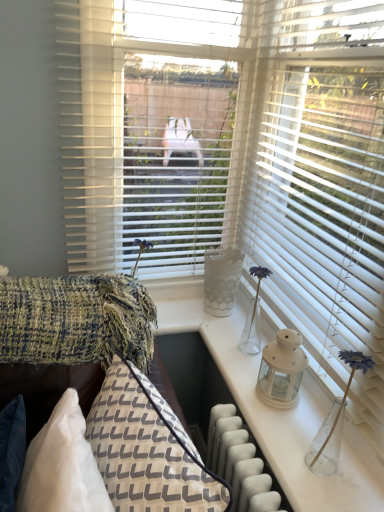
The image size is (384, 512). I want to click on white matte blinds at right, so click(x=317, y=181).

What is the approximate height of matte white lantern at right?

11.38 inches.

Identify the location of matte white lantern at right. This screenshot has width=384, height=512. (334, 422).

Identify the location of textured woolen blanket at left. (76, 320).

The image size is (384, 512). Identify the location of textured woven couch at lower left. (112, 385).

Could you tell me if white matte lantern at center is facing matte white lantern at right?

No, white matte lantern at center is not aimed at matte white lantern at right.

Which of these two, white matte lantern at center or matte white lantern at right, stands shorter?

white matte lantern at center is shorter.

Considering the positions of objects white matte lantern at center and matte white lantern at right in the image provided, who is in front, white matte lantern at center or matte white lantern at right?

Positioned in front is matte white lantern at right.

Considering the positions of objects textured woven pillow at lower left and white matte lantern at center in the image provided, who is in front, textured woven pillow at lower left or white matte lantern at center?

Positioned in front is textured woven pillow at lower left.

In the image, there is a white matte lantern at center. Where is `pillow below it (from the image's perspective)`? The width and height of the screenshot is (384, 512). pillow below it (from the image's perspective) is located at coordinates (62, 466).

Which of these two, textured woven pillow at lower left or white matte lantern at center, stands taller?

textured woven pillow at lower left.

Can you confirm if textured woven pillow at lower left is smaller than white matte lantern at center?

Actually, textured woven pillow at lower left might be larger than white matte lantern at center.

From a real-world perspective, which object stands above the other?

white matte lantern at center, from a real-world perspective.

Identify the location of couch on the left side of white matte lantern at center. (112, 385).

Who is taller, textured woven couch at lower left or white matte lantern at center?

textured woven couch at lower left.

Relative to white matte lantern at center, is textured woven couch at lower left in front or behind?

textured woven couch at lower left is in front of white matte lantern at center.

From the picture: Is white matte blinds at right behind white matte lantern at center?

No, white matte blinds at right is closer to the viewer.

Considering the relative sizes of white matte blinds at right and white matte lantern at center in the image provided, is white matte blinds at right bigger than white matte lantern at center?

Yes, white matte blinds at right is bigger than white matte lantern at center.

Considering the positions of objects white matte blinds at right and white matte lantern at center in the image provided, who is more to the left, white matte blinds at right or white matte lantern at center?

From the viewer's perspective, white matte lantern at center appears more on the left side.

Is the surface of white matte blinds at right in direct contact with white matte lantern at center?

No, white matte blinds at right is not next to white matte lantern at center.

Does matte white lantern at right turn towards textured woolen blanket at left?

No, matte white lantern at right does not turn towards textured woolen blanket at left.

Where is `table lamp that appears below the textured woolen blanket at left (from the image's perspective)`? The height and width of the screenshot is (512, 384). table lamp that appears below the textured woolen blanket at left (from the image's perspective) is located at coordinates click(334, 422).

Between matte white lantern at right and textured woolen blanket at left, which one has smaller size?

matte white lantern at right.

In the scene shown: Considering the positions of objects textured woven couch at lower left and textured woven pillow at lower left in the image provided, who is behind, textured woven couch at lower left or textured woven pillow at lower left?

textured woven pillow at lower left.

Considering the sizes of textured woven couch at lower left and textured woven pillow at lower left in the image, is textured woven couch at lower left taller or shorter than textured woven pillow at lower left?

In the image, textured woven couch at lower left appears to be taller than textured woven pillow at lower left.

From a real-world perspective, is textured woven couch at lower left on textured woven pillow at lower left?

Incorrect, from a real-world perspective, textured woven couch at lower left is lower than textured woven pillow at lower left.

Identify the location of couch below the white matte blinds at right (from the image's perspective). pos(112,385).

Considering the relative sizes of white matte blinds at right and textured woven couch at lower left in the image provided, is white matte blinds at right thinner than textured woven couch at lower left?

Correct, the width of white matte blinds at right is less than that of textured woven couch at lower left.

Are white matte blinds at right and textured woven couch at lower left far apart?

Actually, white matte blinds at right and textured woven couch at lower left are a little close together.

Do you think white matte blinds at right is within textured woven couch at lower left, or outside of it?

white matte blinds at right is outside textured woven couch at lower left.

Locate an element on the screen. The height and width of the screenshot is (512, 384). candle holder that is under the matte white lantern at right (from a real-world perspective) is located at coordinates (282, 370).

Find the location of a particular element. candle holder on the right of textured woven pillow at lower left is located at coordinates (282, 370).

When comparing their distances from white matte blinds at right, does white matte lantern at center or textured woolen blanket at left seem closer?

Result: Based on the image, white matte lantern at center appears to be nearer to white matte blinds at right.

From the image, which object appears to be nearer to matte white lantern at right, white matte lantern at center or textured woolen blanket at left?

Based on the image, white matte lantern at center appears to be nearer to matte white lantern at right.

Estimate the real-world distances between objects in this image. Which object is further from white matte blinds at right, matte white lantern at right or white matte lantern at center?

matte white lantern at right lies further to white matte blinds at right than the other object.

Considering their positions, is white matte lantern at center positioned closer to textured woven couch at lower left than white matte blinds at right?

Among the two, white matte lantern at center is located nearer to textured woven couch at lower left.

Which object lies further to the anchor point textured woven pillow at lower left, textured woolen blanket at left or white matte lantern at center?

Based on the image, white matte lantern at center appears to be further to textured woven pillow at lower left.

From the image, which object appears to be nearer to textured woven pillow at lower left, textured woolen blanket at left or textured woven couch at lower left?

Among the two, textured woven couch at lower left is located nearer to textured woven pillow at lower left.

Which object lies further to the anchor point textured woolen blanket at left, white matte blinds at right or matte white lantern at right?

white matte blinds at right.

Based on the photo, considering their positions, is white matte lantern at center positioned closer to textured woven pillow at lower left than white matte blinds at right?

white matte lantern at center.

This screenshot has width=384, height=512. I want to click on candle holder situated between textured woolen blanket at left and matte white lantern at right from left to right, so click(x=282, y=370).

Where is `pillow between textured woven couch at lower left and white matte lantern at center along the z-axis`? The height and width of the screenshot is (512, 384). pillow between textured woven couch at lower left and white matte lantern at center along the z-axis is located at coordinates (62, 466).

Identify the location of candle holder between white matte blinds at right and textured woven pillow at lower left in the vertical direction. (282, 370).

Identify the location of candle holder situated between textured woolen blanket at left and white matte blinds at right from left to right. (282, 370).